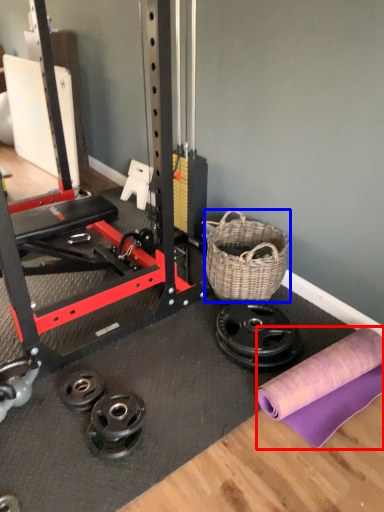
Question: Among these objects, which one is nearest to the camera, fabric (highlighted by a red box) or basket (highlighted by a blue box)?

Choices:
 (A) fabric
 (B) basket

Answer: (A)